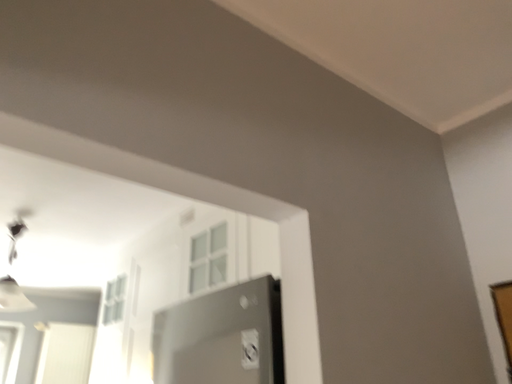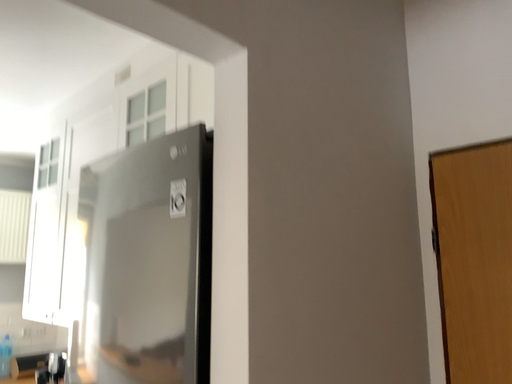
Question: Which way did the camera rotate in the video?

Choices:
 (A) rotated upward
 (B) rotated downward

Answer: (B)